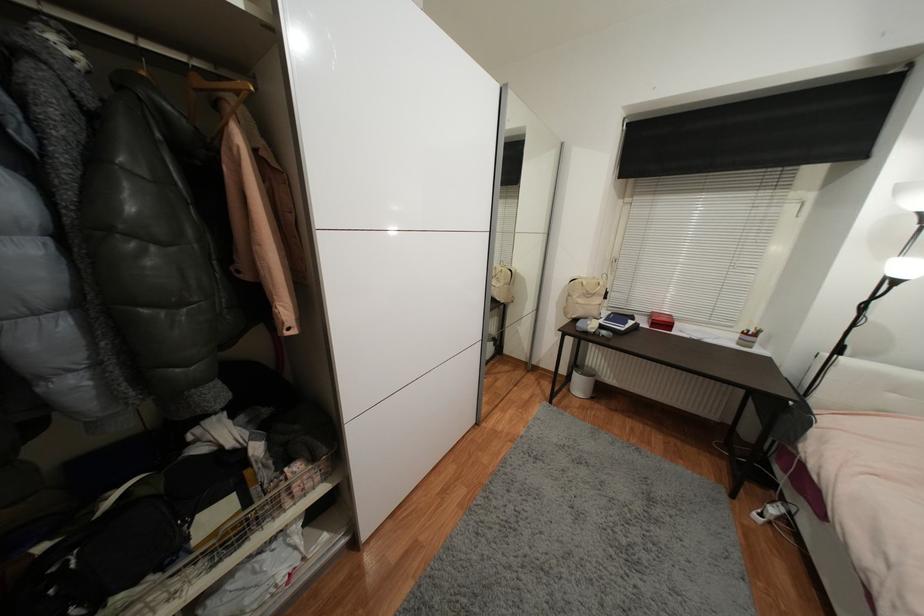
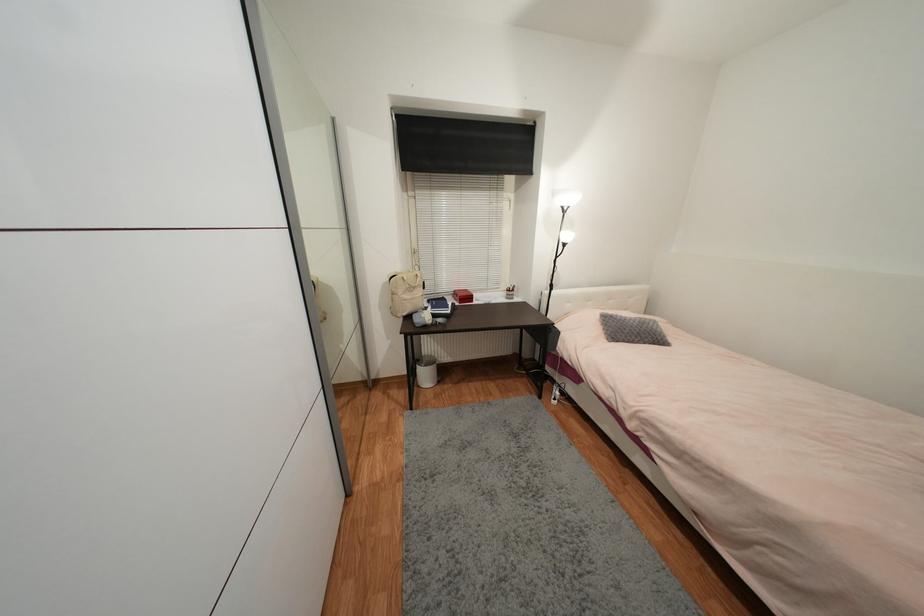
Find the pixel in the second image that matches (599,280) in the first image.

(412, 273)